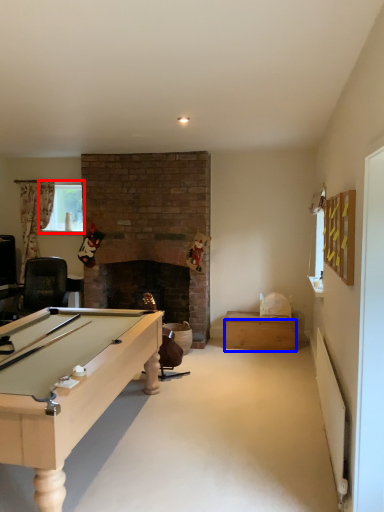
Question: Which object is closer to the camera taking this photo, window screen (highlighted by a red box) or drawer (highlighted by a blue box)?

Choices:
 (A) window screen
 (B) drawer

Answer: (B)